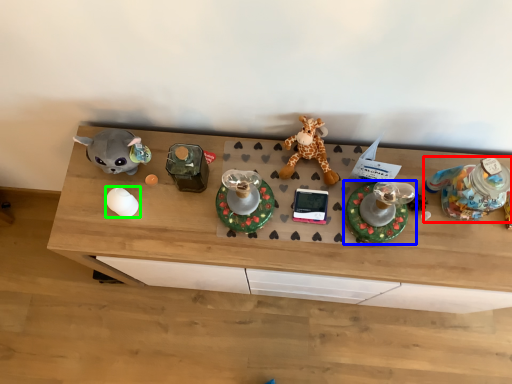
Question: Which object is positioned farthest from toy (highlighted by a red box)? Select from toy (highlighted by a blue box) and toy (highlighted by a green box).

Choices:
 (A) toy
 (B) toy

Answer: (B)